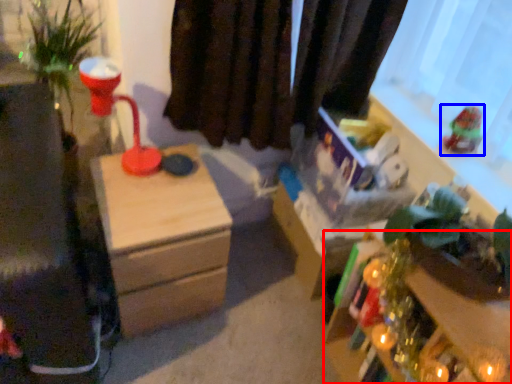
Question: Which point is further to the camera, table (highlighted by a red box) or toy (highlighted by a blue box)?

Choices:
 (A) table
 (B) toy

Answer: (B)